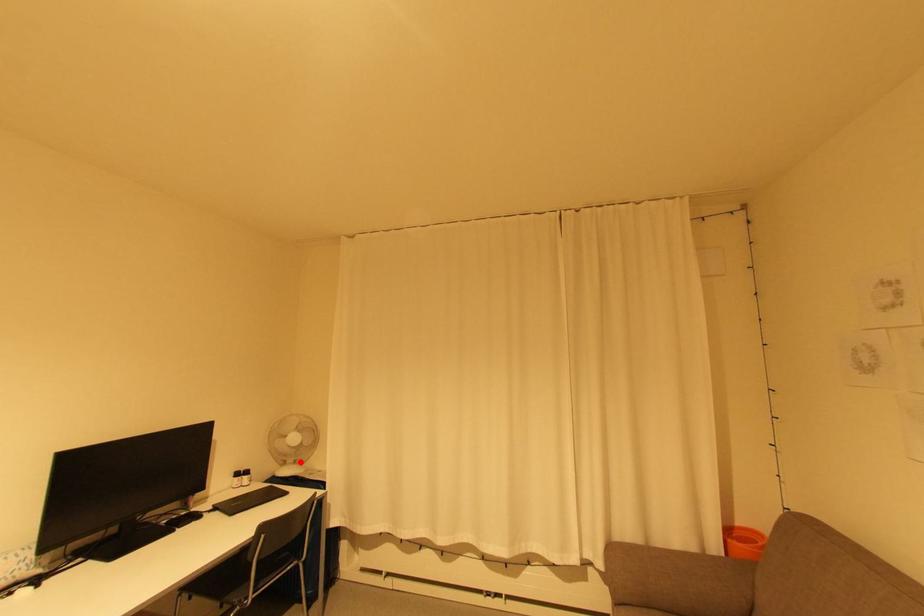
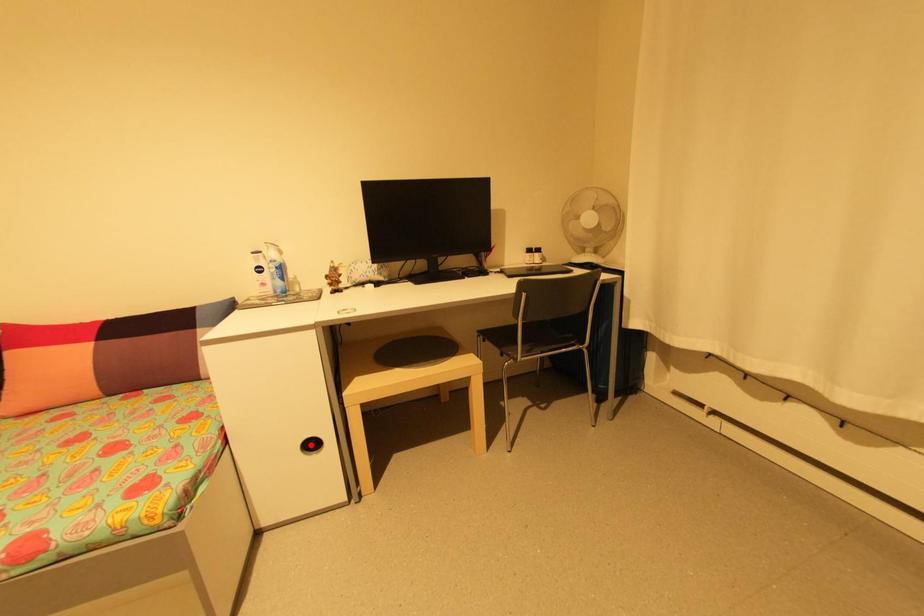
I am providing you with two images of the same scene from different viewpoints. A red point is marked on the first image and another point is marked on the second image. Does the point marked in image1 correspond to the same location as the one in image2?

No